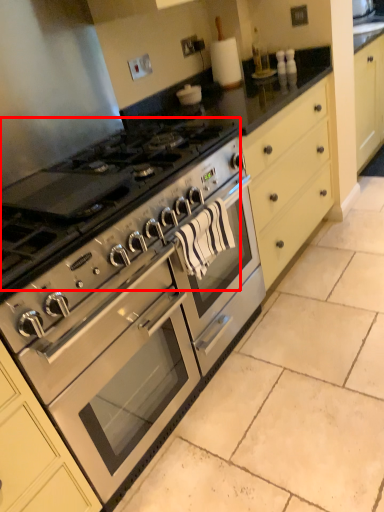
Question: From the image's perspective, considering the relative positions of gas stove (annotated by the red box) and oven in the image provided, where is gas stove (annotated by the red box) located with respect to the staircase?

Choices:
 (A) below
 (B) above

Answer: (B)